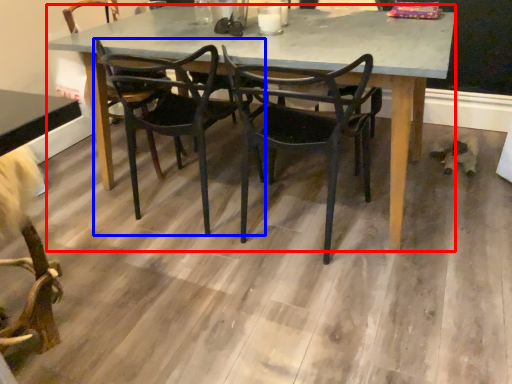
Question: Which of the following is the farthest to the observer, kitchen & dining room table (highlighted by a red box) or chair (highlighted by a blue box)?

Choices:
 (A) kitchen & dining room table
 (B) chair

Answer: (B)